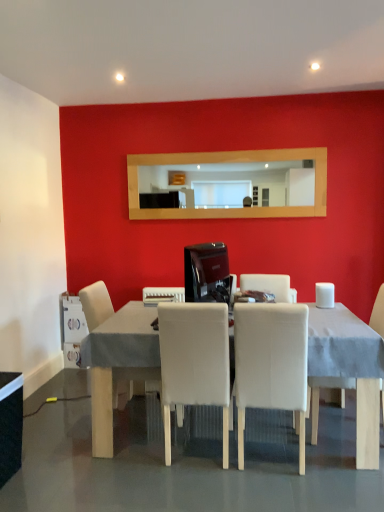
Question: From a real-world perspective, is white fabric chair at center, arranged as the third chair when viewed from the left, physically located above or below white plastic toaster at lower center, which ranks as the 2th appliance in left-to-right order?

Choices:
 (A) below
 (B) above

Answer: (A)

Question: Visually, is white fabric chair at center, the 2th chair from the right, positioned to the left or to the right of white plastic toaster at lower center, which ranks as the 2th appliance in left-to-right order?

Choices:
 (A) left
 (B) right

Answer: (B)

Question: Based on their relative distances, which object is farther from the white plastic milk carton at lower left, which is the third appliance from top to bottom?

Choices:
 (A) white fabric chair at center, the 2th chair from the right
 (B) wooden mirror at upper center
 (C) white fabric chair at right, which is counted as the first chair, starting from the right
 (D) white fabric table at center, which is the 1th table from right to left
 (E) white plastic toaster at lower center, which ranks as the 2th appliance in left-to-right order

Answer: (C)

Question: Estimate the real-world distances between objects in this image. Which object is closer to the white fabric chair at right, arranged as the 4th chair when viewed from the left?

Choices:
 (A) glossy black coffee machine at center, acting as the first appliance starting from the right
 (B) white plastic toaster at lower center, which ranks as the 2th appliance in left-to-right order
 (C) white leather chair at center, positioned as the first chair in left-to-right order
 (D) white leather chair at center, which ranks as the second chair in left-to-right order
 (E) white fabric table at center, which is the 1th table from right to left

Answer: (D)